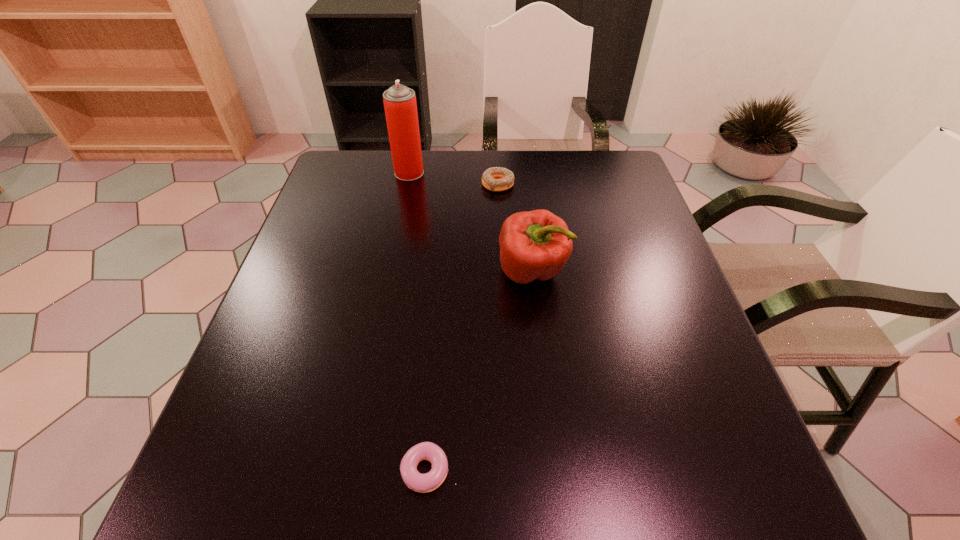
I want to click on object that is the closest one to the aerosol can, so pos(496,179).

Identify which object is the second nearest to the aerosol can. Please provide its 2D coordinates. Your answer should be formatted as a tuple, i.e. [(x, y)], where the tuple contains the x and y coordinates of a point satisfying the conditions above.

[(536, 244)]

Identify the location of free space that satisfies the following two spatial constraints: 1. on the back side of the shorter doughnut; 2. on the left side of the right doughnut. (451, 184).

Identify the location of free spot that satisfies the following two spatial constraints: 1. on the front side of the bell pepper; 2. on the right side of the taller doughnut. [x=502, y=272].